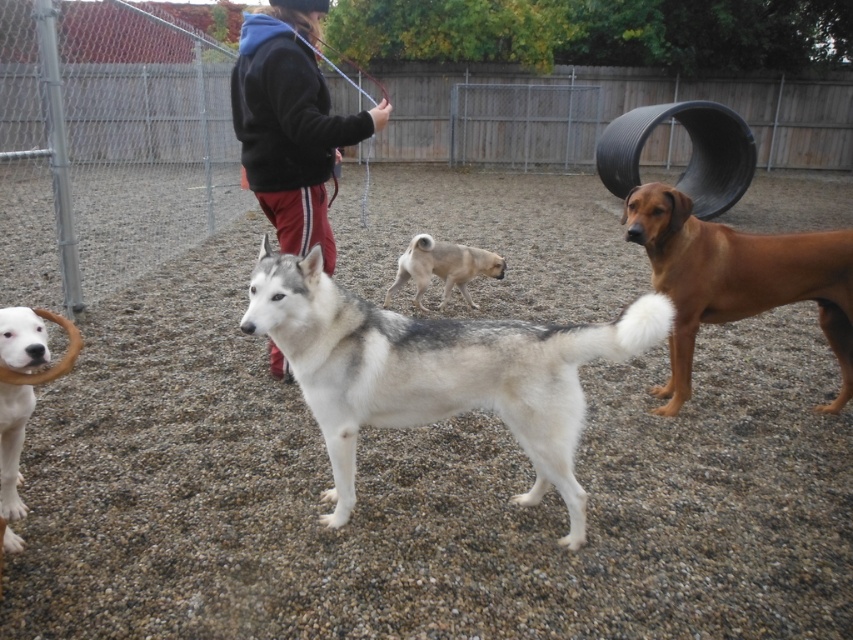
You are a photographer setting up a tripod in the center of the dog park. You need to ensure that both the brown glossy dog at right and the black fleece jacket at center are visible in your shot. Given their sizes, which object will require more space in your frame?

The brown glossy dog at right requires more space in the frame because its width is larger than the black fleece jacket at center.